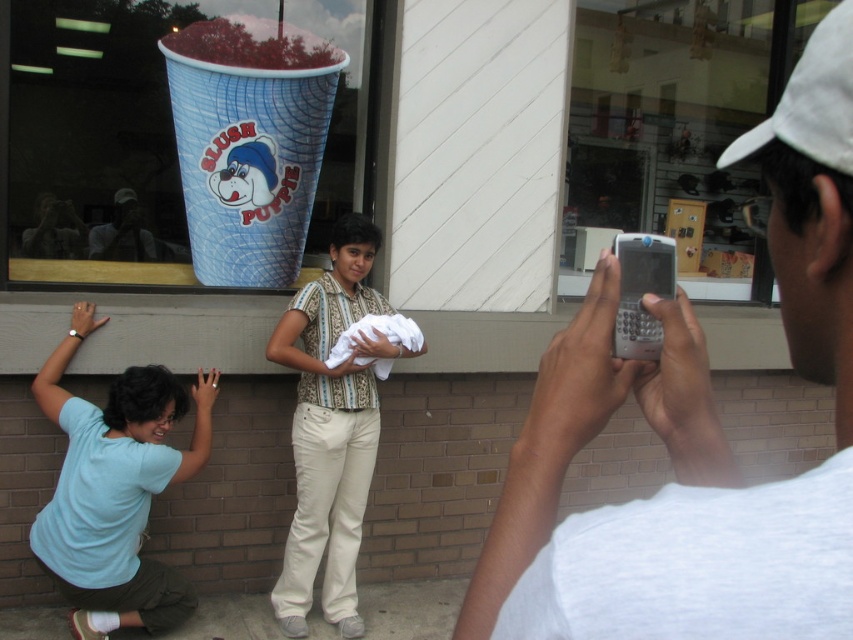
You are standing in front of the store and see the point at coordinates (115, 488). Which object is this point located on?

The point at coordinates (115, 488) is located on the light blue t shirt at lower left.

You are a customer standing in front of the store and see the silver metallic phone at upper right and the striped cotton shirt at center. Which object is located more to the right?

The silver metallic phone at upper right is more to the right because it is positioned on the right side of the striped cotton shirt at center.